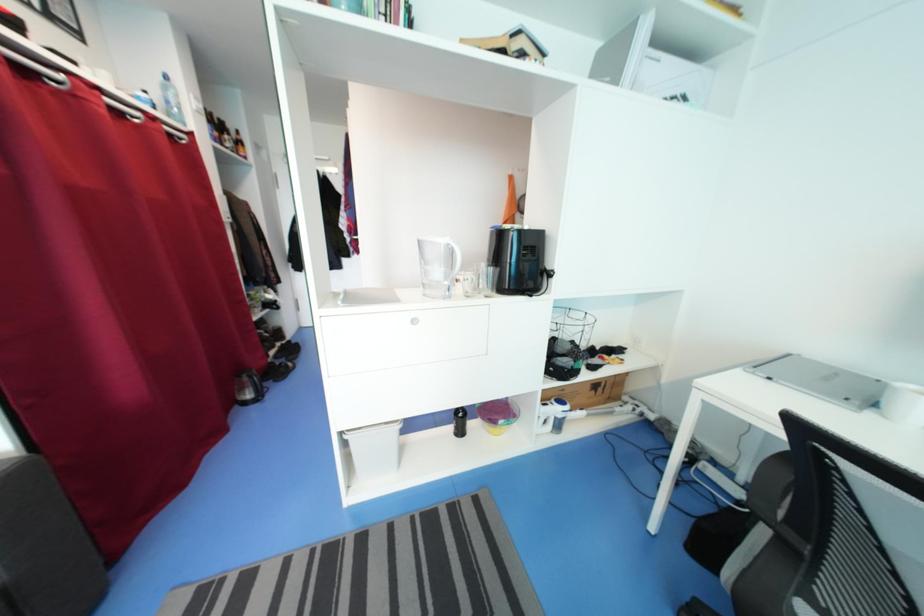
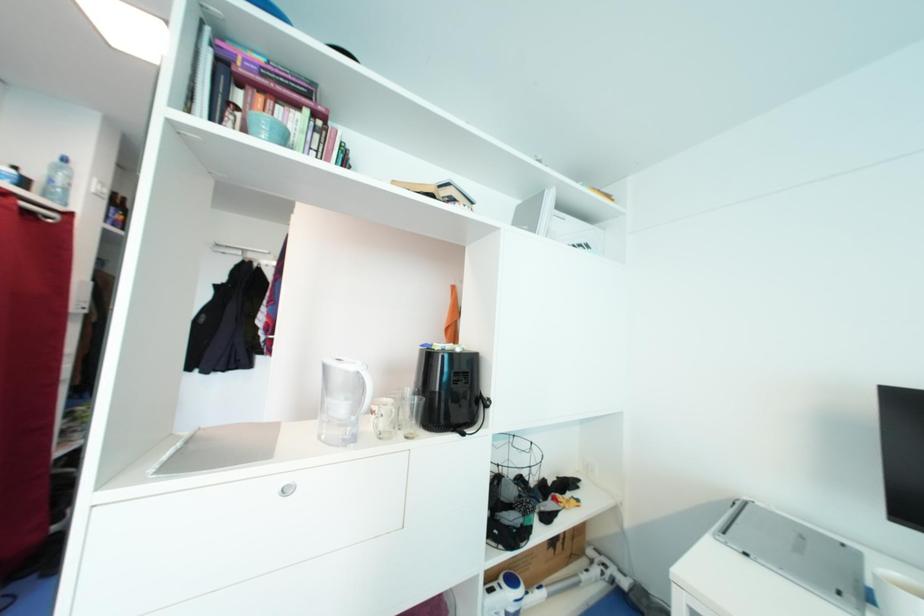
In a continuous first-person perspective shot, in which direction is the camera moving?

The cameraman moved toward right, forward.